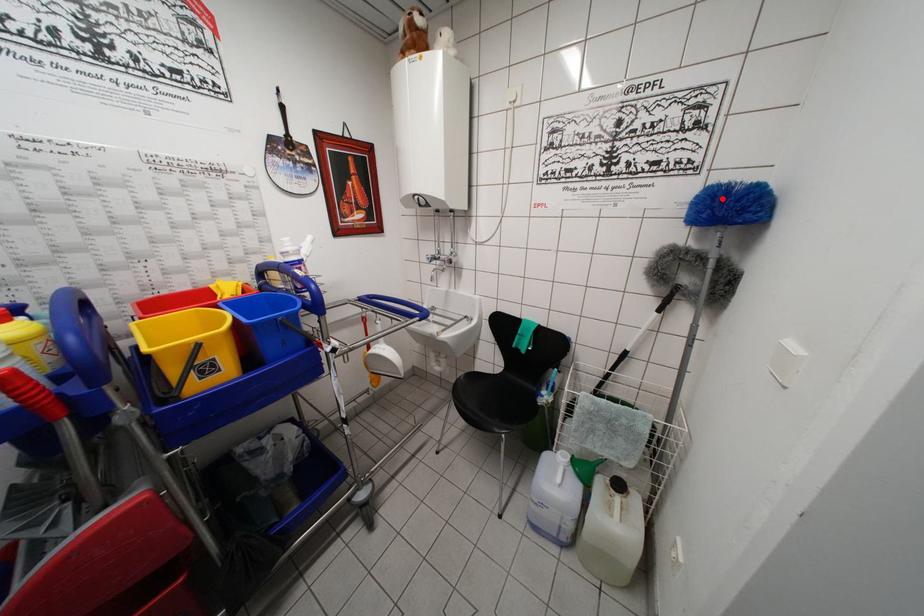
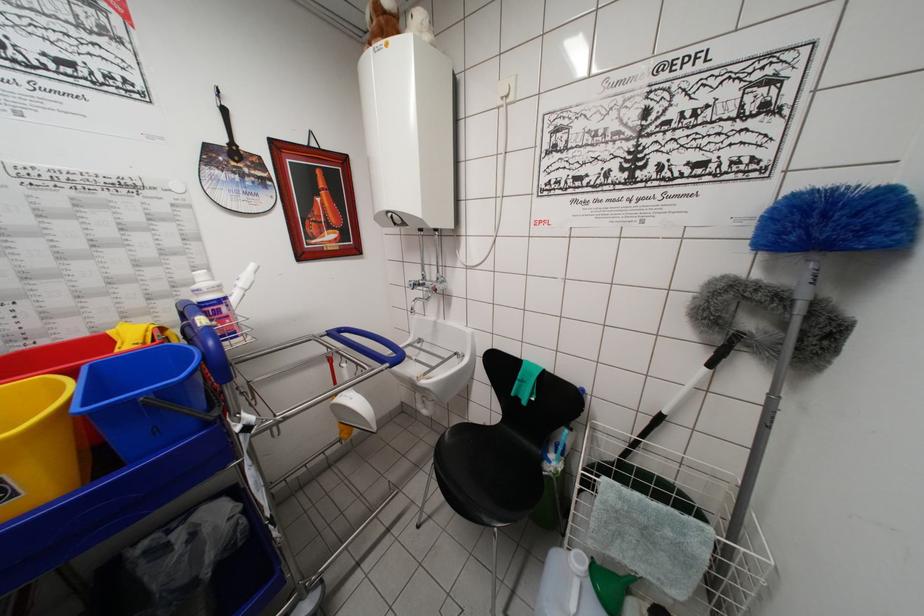
Question: I am providing you with two images of the same scene from different viewpoints. A red point is marked on the first image. At the location where the point appears in image 1, is it still visible in image 2?

Choices:
 (A) Yes
 (B) No

Answer: (A)